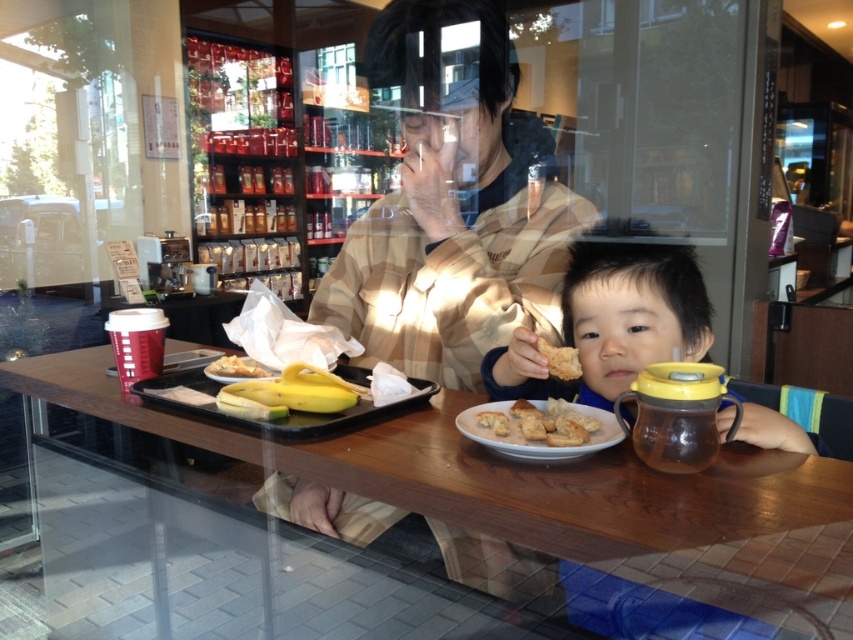
Between light brown plaid shirt at center and yellow matte banana at center, which one is positioned higher?

Positioned higher is light brown plaid shirt at center.

Is light brown plaid shirt at center above yellow matte banana at center?

Correct, light brown plaid shirt at center is located above yellow matte banana at center.

Where is `light brown plaid shirt at center`? The width and height of the screenshot is (853, 640). light brown plaid shirt at center is located at coordinates (451, 209).

You are a GUI agent. You are given a task and a screenshot of the screen. Output one action in this format:
    pyautogui.click(x=<x>, y=<y>)
    Task: Click on the light brown plaid shirt at center
    
    Given the screenshot: What is the action you would take?
    pyautogui.click(x=451, y=209)

Between black plastic tray at center and white crumbly bread at left, which one is positioned higher?

Positioned higher is white crumbly bread at left.

Image resolution: width=853 pixels, height=640 pixels. What do you see at coordinates (276, 419) in the screenshot?
I see `black plastic tray at center` at bounding box center [276, 419].

You are a GUI agent. You are given a task and a screenshot of the screen. Output one action in this format:
    pyautogui.click(x=<x>, y=<y>)
    Task: Click on the black plastic tray at center
    The width and height of the screenshot is (853, 640).
    Given the screenshot: What is the action you would take?
    pyautogui.click(x=276, y=419)

Does light brown plaid shirt at center have a larger size compared to white crumbly bread at left?

Correct, light brown plaid shirt at center is larger in size than white crumbly bread at left.

Between point (369, 72) and point (256, 368), which one is positioned in front?

Point (256, 368)

Between point (323, 497) and point (264, 371), which one is positioned behind?

The point (323, 497) is behind.

Locate an element on the screen. The height and width of the screenshot is (640, 853). light brown plaid shirt at center is located at coordinates (451, 209).